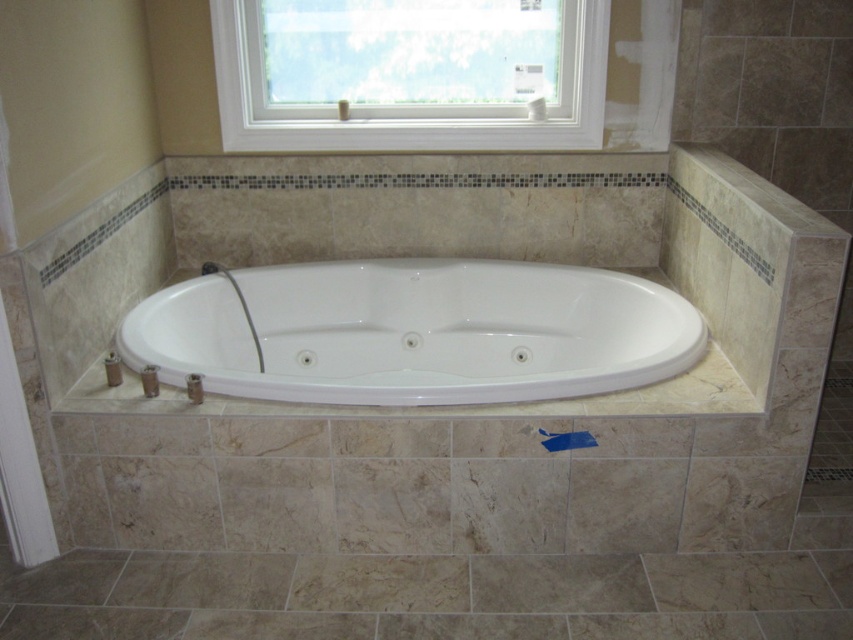
Question: Which of the following is the closest to the observer?

Choices:
 (A) (343, 147)
 (B) (213, 268)
 (C) (473, 570)
 (D) (691, 321)

Answer: (C)

Question: Does beige marble tile at lower center come behind matte white shower at lower left?

Choices:
 (A) yes
 (B) no

Answer: (B)

Question: Estimate the real-world distances between objects in this image. Which object is farther from the matte white shower at lower left?

Choices:
 (A) white glossy bathtub at center
 (B) beige marble tile at lower center

Answer: (B)

Question: Is white glossy bathtub at center above white plastic window at upper center?

Choices:
 (A) yes
 (B) no

Answer: (B)

Question: Estimate the real-world distances between objects in this image. Which object is farther from the beige marble tile at lower center?

Choices:
 (A) matte white shower at lower left
 (B) white plastic window at upper center
 (C) white glossy bathtub at center

Answer: (B)

Question: Does white glossy bathtub at center appear over white plastic window at upper center?

Choices:
 (A) yes
 (B) no

Answer: (B)